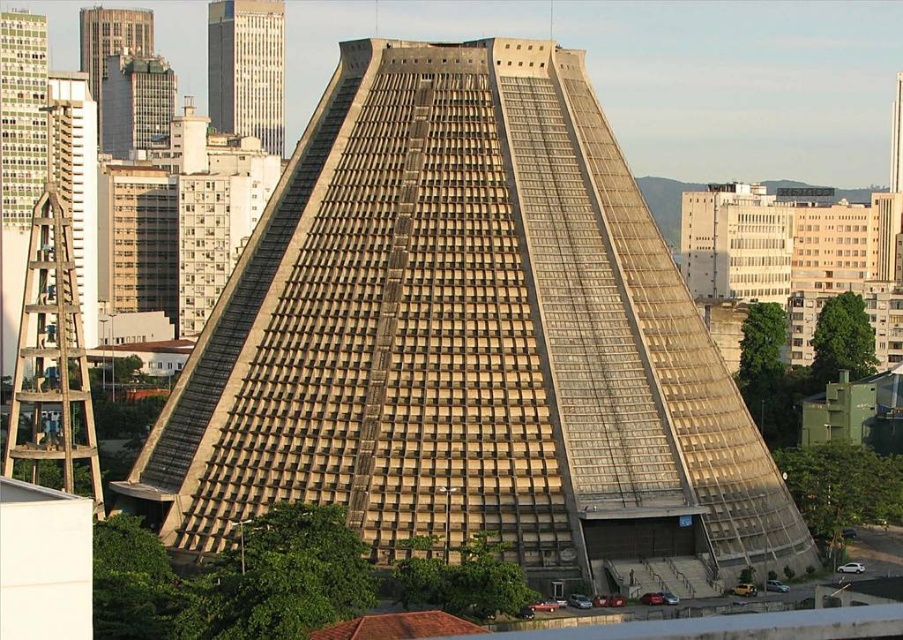
Does beige concrete pyramid at center have a greater width compared to metallic glass skyscraper at upper left?

Correct, the width of beige concrete pyramid at center exceeds that of metallic glass skyscraper at upper left.

Who is taller, beige concrete pyramid at center or metallic glass skyscraper at upper left?

Standing taller between the two is beige concrete pyramid at center.

The image size is (903, 640). I want to click on beige concrete pyramid at center, so click(468, 342).

Who is higher up, beige concrete pyramid at center or smooth glass skyscraper at upper left?

Positioned higher is smooth glass skyscraper at upper left.

Can you confirm if beige concrete pyramid at center is wider than smooth glass skyscraper at upper left?

Yes.

Locate an element on the screen. The width and height of the screenshot is (903, 640). beige concrete pyramid at center is located at coordinates (468, 342).

Between smooth glass skyscraper at upper left and metallic glass skyscraper at upper left, which one has more height?

smooth glass skyscraper at upper left is taller.

Can you confirm if smooth glass skyscraper at upper left is thinner than metallic glass skyscraper at upper left?

Indeed, smooth glass skyscraper at upper left has a lesser width compared to metallic glass skyscraper at upper left.

Does point (212, 83) come in front of point (120, 120)?

No.

At what (x,y) coordinates should I click in order to perform the action: click on smooth glass skyscraper at upper left. Please return your answer as a coordinate pair (x, y). This screenshot has height=640, width=903. Looking at the image, I should click on (247, 68).